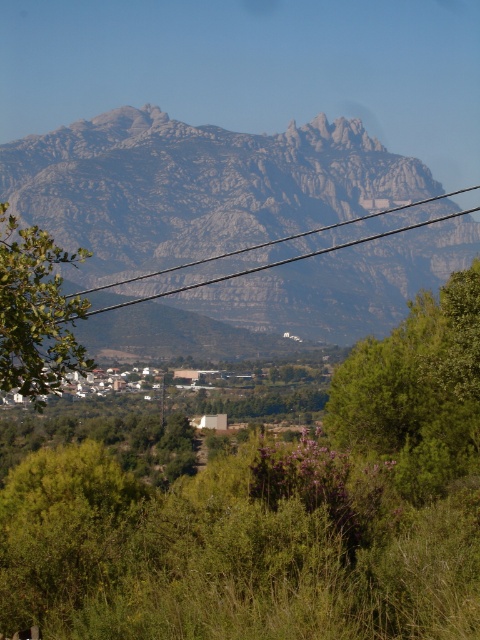
How much distance is there between green leafy tree at center and black wire at upper center?

green leafy tree at center and black wire at upper center are 210.92 feet apart.

Who is higher up, green leafy tree at center or black wire at upper center?

Positioned higher is black wire at upper center.

Is point (384, 432) positioned in front of point (397, 205)?

Yes, point (384, 432) is closer to viewer.

I want to click on green leafy tree at center, so click(417, 392).

From the picture: Between green leafy tree at lower left and black wire at upper center, which one is positioned higher?

black wire at upper center is above.

Who is lower down, green leafy tree at lower left or black wire at upper center?

green leafy tree at lower left is lower down.

What do you see at coordinates (36, 312) in the screenshot? I see `green leafy tree at lower left` at bounding box center [36, 312].

Find the location of `green leafy tree at lower left`. green leafy tree at lower left is located at coordinates (36, 312).

Between green leafy tree at center and green leafy tree at lower left, which one is positioned higher?

green leafy tree at lower left is higher up.

Between point (376, 435) and point (10, 253), which one is positioned in front?

Positioned in front is point (10, 253).

The image size is (480, 640). What do you see at coordinates (417, 392) in the screenshot?
I see `green leafy tree at center` at bounding box center [417, 392].

You are a GUI agent. You are given a task and a screenshot of the screen. Output one action in this format:
    pyautogui.click(x=<x>, y=<y>)
    Task: Click on the green leafy tree at center
    
    Given the screenshot: What is the action you would take?
    pyautogui.click(x=417, y=392)